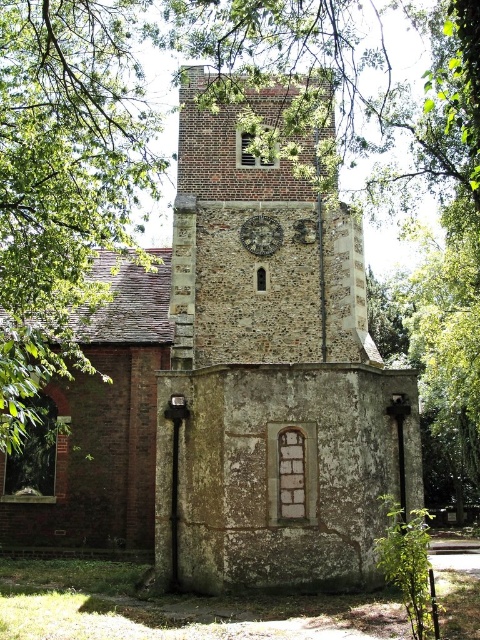
You are an architect examining the historic stone church building. You notice two clock features on the facade. The first is the stone clock tower at center, and the second is the rustic stone clock at center. Which of these two features is bigger in size?

The stone clock tower at center is larger in size than the rustic stone clock at center.

You are standing at point (156,310) and want to reach the historic stone church building. Given that the distance between you and the church is 216.70 feet, can you estimate how many steps you would need to take if each step covers approximately 2.5 feet?

The distance between you and the historic stone church building is 216.70 feet. Since each step covers about 2.5 feet, you would need approximately 216.70 divided by 2.5, which equals roughly 86.68 steps. Rounding up, you would need about 87 steps to reach the church.

You are standing in front of the historic stone church building and notice two clocks on its facade. The stone clock tower at center and the rustic stone clock at center. Which one is positioned to the left?

The stone clock tower at center is positioned to the left of the rustic stone clock at center.